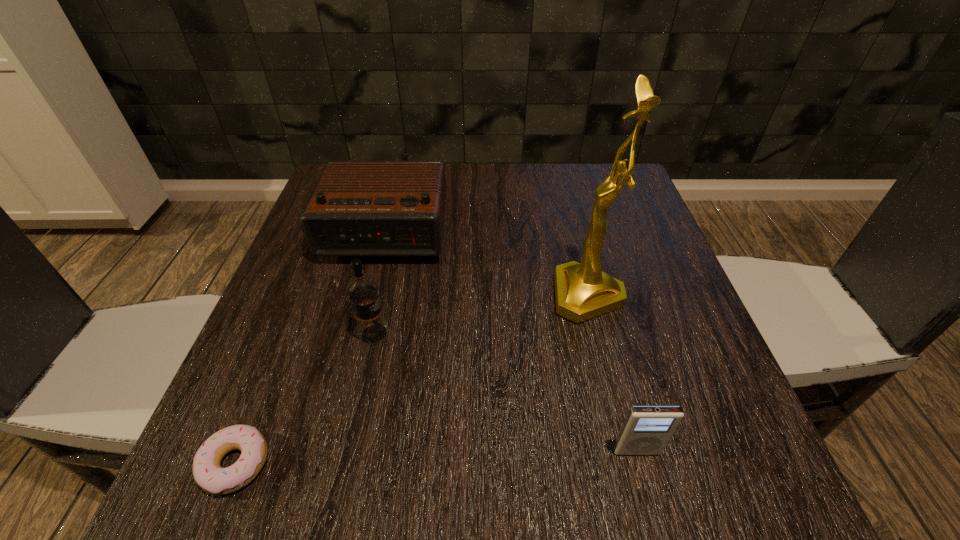
The width and height of the screenshot is (960, 540). I want to click on object that is at the far left corner, so click(x=359, y=208).

You are a GUI agent. You are given a task and a screenshot of the screen. Output one action in this format:
    pyautogui.click(x=<x>, y=<y>)
    Task: Click on the object at the near left corner
    This screenshot has width=960, height=540.
    Given the screenshot: What is the action you would take?
    pyautogui.click(x=209, y=475)

The image size is (960, 540). In order to click on object located in the near right corner section of the desktop in this screenshot , I will do `click(646, 430)`.

Find the location of a particular element. This screenshot has width=960, height=540. vacant space at the far edge of the desktop is located at coordinates click(x=575, y=204).

Locate an element on the screen. vacant area at the near edge is located at coordinates (604, 481).

I want to click on free space at the right edge, so pos(642,237).

Locate an element on the screen. The image size is (960, 540). free space at the near left corner of the desktop is located at coordinates [x=300, y=467].

I want to click on free space at the far right corner of the desktop, so click(x=609, y=209).

In the image, there is a desktop. Find the location of `vacant area at the near right corner`. vacant area at the near right corner is located at coordinates pyautogui.click(x=760, y=507).

At what (x,y) coordinates should I click in order to perform the action: click on vacant point located between the shortest object and the second shortest object. Please return your answer as a coordinate pair (x, y). The width and height of the screenshot is (960, 540). Looking at the image, I should click on (436, 458).